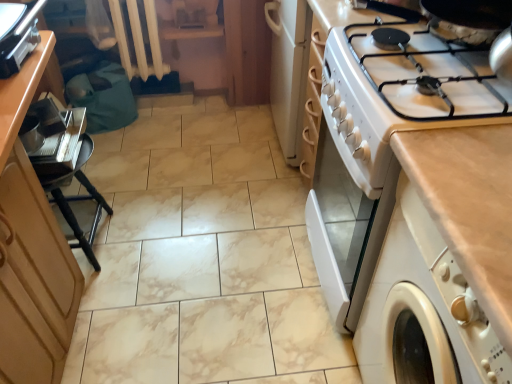
Question: Can you confirm if beige laminate countertop at right is thinner than metallic silver tray at left?

Choices:
 (A) yes
 (B) no

Answer: (B)

Question: Does beige laminate countertop at right have a smaller size compared to metallic silver tray at left?

Choices:
 (A) no
 (B) yes

Answer: (A)

Question: Is beige laminate countertop at right oriented towards metallic silver tray at left?

Choices:
 (A) yes
 (B) no

Answer: (B)

Question: Can you confirm if beige laminate countertop at right is shorter than metallic silver tray at left?

Choices:
 (A) yes
 (B) no

Answer: (B)

Question: Is the depth of beige laminate countertop at right greater than that of metallic silver tray at left?

Choices:
 (A) no
 (B) yes

Answer: (A)

Question: Is metallic silver tray at left surrounded by beige laminate countertop at right?

Choices:
 (A) no
 (B) yes

Answer: (A)

Question: Considering the relative sizes of metallic silver toaster at upper left and wooden cabinet at left in the image provided, is metallic silver toaster at upper left bigger than wooden cabinet at left?

Choices:
 (A) yes
 (B) no

Answer: (B)

Question: Can you confirm if metallic silver toaster at upper left is taller than wooden cabinet at left?

Choices:
 (A) yes
 (B) no

Answer: (B)

Question: From the image's perspective, does metallic silver toaster at upper left appear lower than wooden cabinet at left?

Choices:
 (A) no
 (B) yes

Answer: (A)

Question: From a real-world perspective, is metallic silver toaster at upper left physically below wooden cabinet at left?

Choices:
 (A) no
 (B) yes

Answer: (A)

Question: Does metallic silver toaster at upper left come behind wooden cabinet at left?

Choices:
 (A) no
 (B) yes

Answer: (B)

Question: Is metallic silver toaster at upper left far from wooden cabinet at left?

Choices:
 (A) yes
 (B) no

Answer: (B)

Question: Would you say metallic silver toaster at upper left is part of wooden cabinet at left's contents?

Choices:
 (A) no
 (B) yes

Answer: (A)